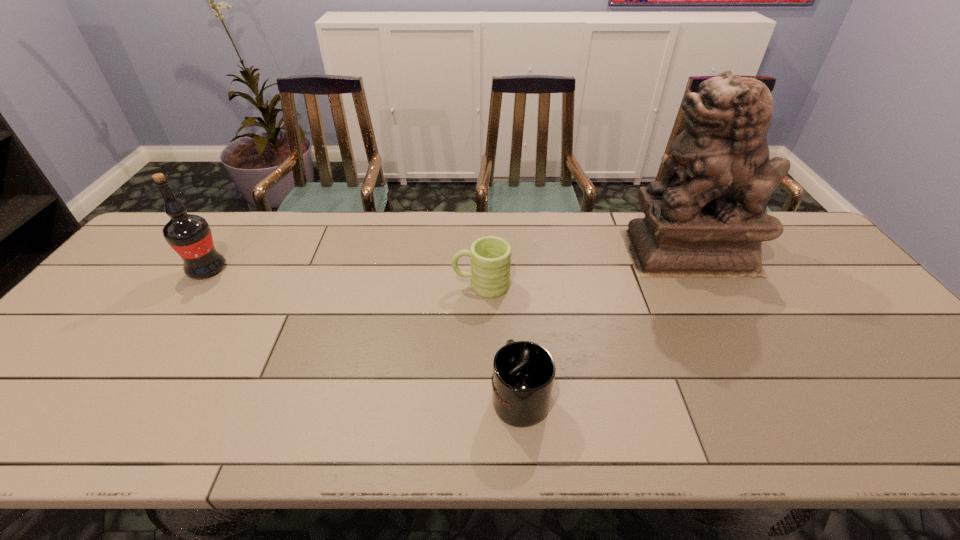
Where is `sculpture`? The height and width of the screenshot is (540, 960). sculpture is located at coordinates (707, 217).

Find the location of `the tallest object`. the tallest object is located at coordinates (707, 217).

Image resolution: width=960 pixels, height=540 pixels. Find the location of `the second tallest object`. the second tallest object is located at coordinates (189, 235).

Find the location of a particular element. The image size is (960, 540). wine bottle is located at coordinates (189, 235).

Where is `the farther mug`? the farther mug is located at coordinates (490, 264).

You are a GUI agent. You are given a task and a screenshot of the screen. Output one action in this format:
    pyautogui.click(x=<x>, y=<y>)
    Task: Click on the nearest object
    
    Given the screenshot: What is the action you would take?
    pyautogui.click(x=523, y=375)

You are a GUI agent. You are given a task and a screenshot of the screen. Output one action in this format:
    pyautogui.click(x=<x>, y=<y>)
    Task: Click on the free space located on the front-facing side of the tallest object
    Image resolution: width=960 pixels, height=540 pixels.
    Given the screenshot: What is the action you would take?
    pyautogui.click(x=559, y=252)

Identify the location of vacant space located 0.370m on the front-facing side of the tallest object. (506, 252).

The width and height of the screenshot is (960, 540). What are the coordinates of `vacant space situated 0.370m on the front-facing side of the tallest object` in the screenshot? It's located at (506, 252).

Find the location of a particular element. Image resolution: width=960 pixels, height=540 pixels. free location located 0.150m on the front of the wine bottle is located at coordinates (171, 321).